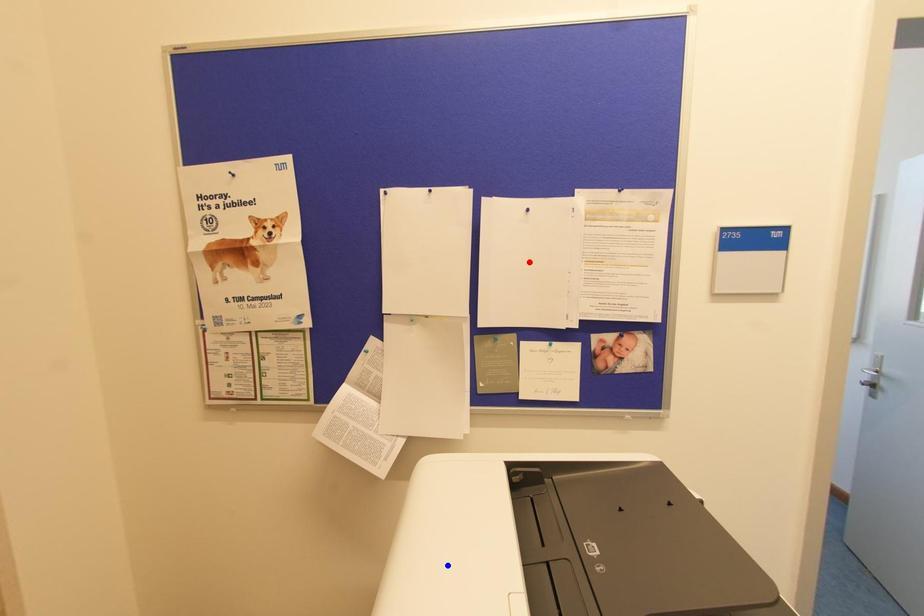
Question: In the image, two points are highlighted. Which point is nearer to the camera? Reply with the corresponding letter.

Choices:
 (A) blue point
 (B) red point

Answer: (A)